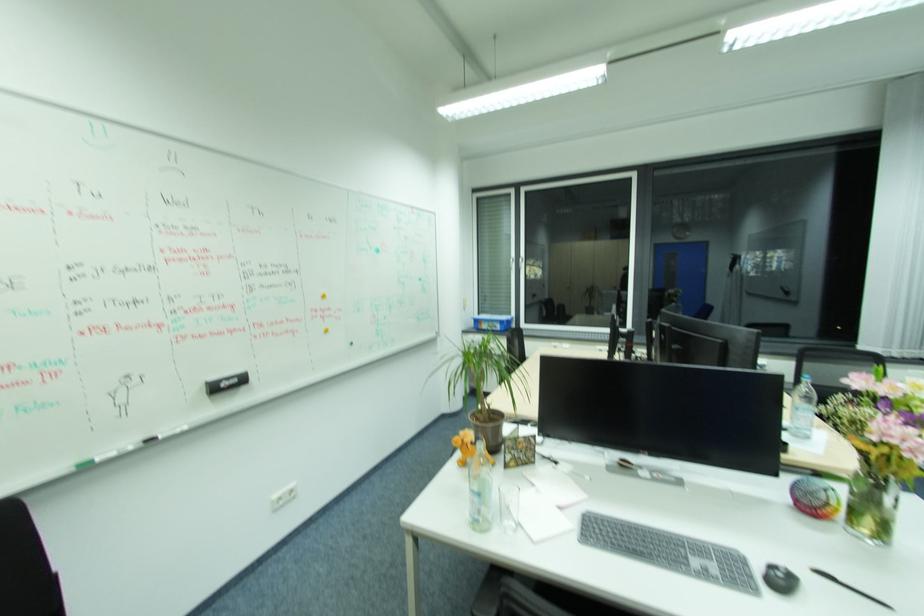
Find the location of a particular element. Image resolution: width=924 pixels, height=616 pixels. black pen is located at coordinates (849, 588).